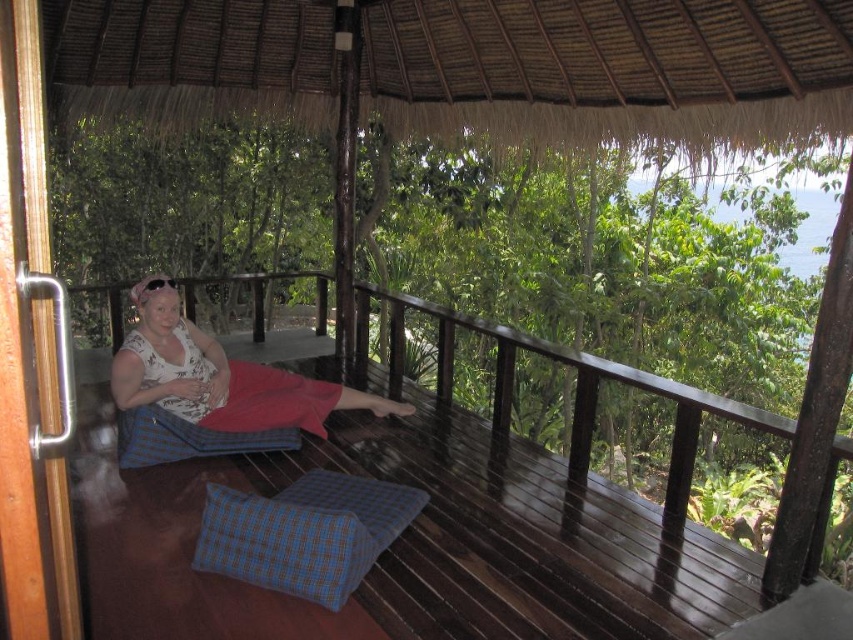
You are standing at point (x=677, y=92) and want to reach the entrance of the terrace. The entrance is located at the opposite corner of the terrace. If the terrace is a rectangle, what is the minimum distance you need to walk to reach the entrance?

The minimum distance you need to walk is 4.14 meters, which is the straight line distance between the two points.

You are standing on the balcony and need to find the matte white blouse at center. According to the coordinates provided, where should you look relative to the center of the image?

The matte white blouse at center is located at point coordinates (219, 376), which means it is slightly to the right and just below the center of the image.

You are a painter standing on the balcony and want to paint the thatched straw roof at upper center and the matte white blouse at center. Which object should you focus on first if you want to paint the wider object first?

The thatched straw roof at upper center might be wider than the matte white blouse at center, so you should focus on painting the thatched straw roof at upper center first.